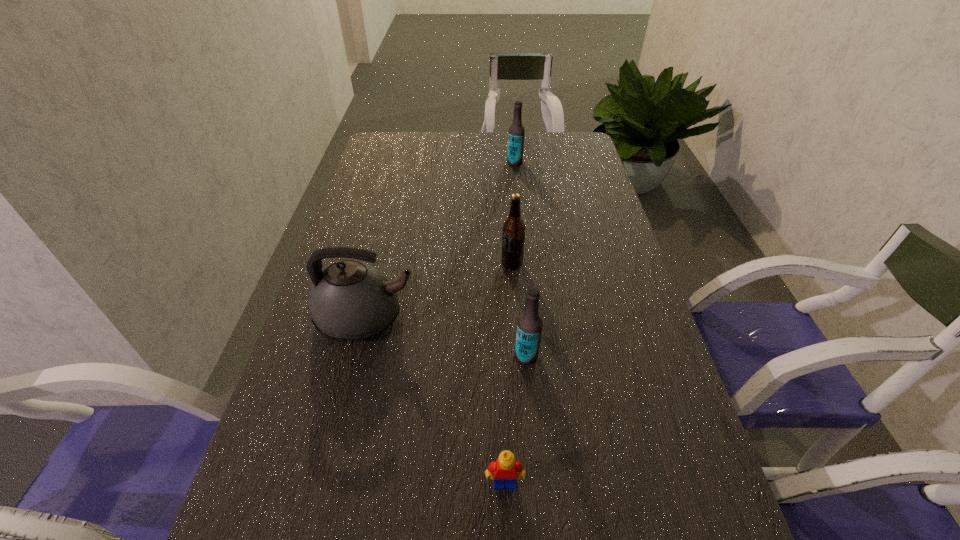
The height and width of the screenshot is (540, 960). Find the location of `object that is the third closest to the nearest beer bottle`. object that is the third closest to the nearest beer bottle is located at coordinates (513, 232).

Find the location of a particular element. This screenshot has height=540, width=960. object that can be found as the third closest to the nearest beer bottle is located at coordinates coord(513,232).

Identify which beer bottle is located as the nearest to the nearest beer bottle. Please provide its 2D coordinates. Your answer should be formatted as a tuple, i.e. [(x, y)], where the tuple contains the x and y coordinates of a point satisfying the conditions above.

[(513, 232)]

Select which beer bottle is the closest to the farthest beer bottle. Please provide its 2D coordinates. Your answer should be formatted as a tuple, i.e. [(x, y)], where the tuple contains the x and y coordinates of a point satisfying the conditions above.

[(513, 232)]

You are a GUI agent. You are given a task and a screenshot of the screen. Output one action in this format:
    pyautogui.click(x=<x>, y=<y>)
    Task: Click on the free space that satisfies the following two spatial constraints: 1. on the label of the nearest beer bottle; 2. on the face of the nearest object
    The width and height of the screenshot is (960, 540).
    Given the screenshot: What is the action you would take?
    pyautogui.click(x=538, y=483)

At what (x,y) coordinates should I click in order to perform the action: click on free spot that satisfies the following two spatial constraints: 1. on the side of the farthest beer bottle with the label; 2. on the face of the shortest object. Please return your answer as a coordinate pair (x, y). The height and width of the screenshot is (540, 960). Looking at the image, I should click on (550, 483).

Locate an element on the screen. The height and width of the screenshot is (540, 960). free spot that satisfies the following two spatial constraints: 1. on the label of the second farthest object; 2. on the face of the Lego is located at coordinates (528, 483).